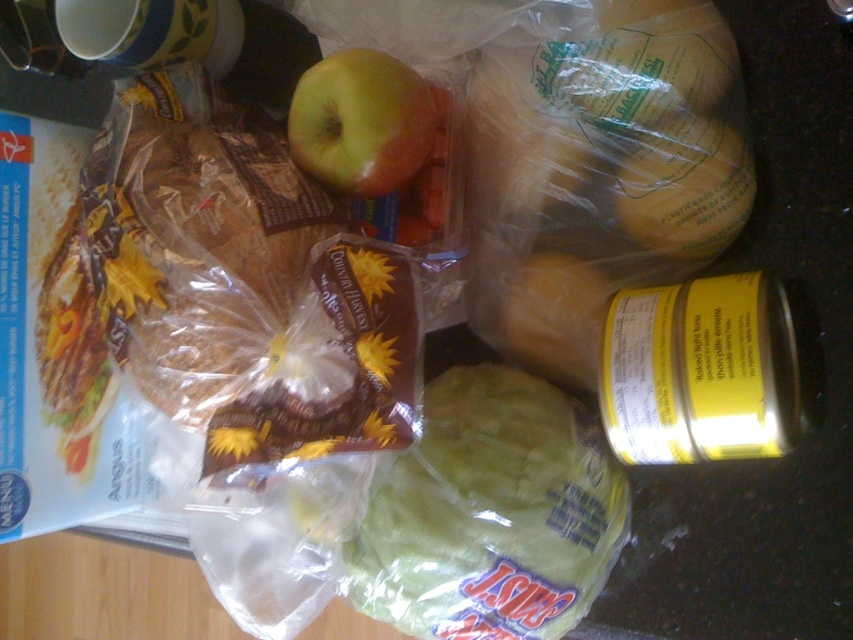
You are a delivery person who needs to place a package that is 10 inches long on the counter. The package must be placed between the green plastic cabbage at center and the green matte apple at center. Is there enough space between them to fit the package?

The distance between the green plastic cabbage at center and the green matte apple at center is 9.69 inches. Since the package is 10 inches long, it will not fit between them as the space is slightly smaller than the package.

Consider the image. You are holding a banana at point (451, 547) and want to place it on the counter so that it is exactly 24 inches away from you. Should you move it closer or farther away?

The point (451, 547) is currently 23.75 inches away from you. To reach exactly 24 inches, you should move the banana slightly farther away from your current position.